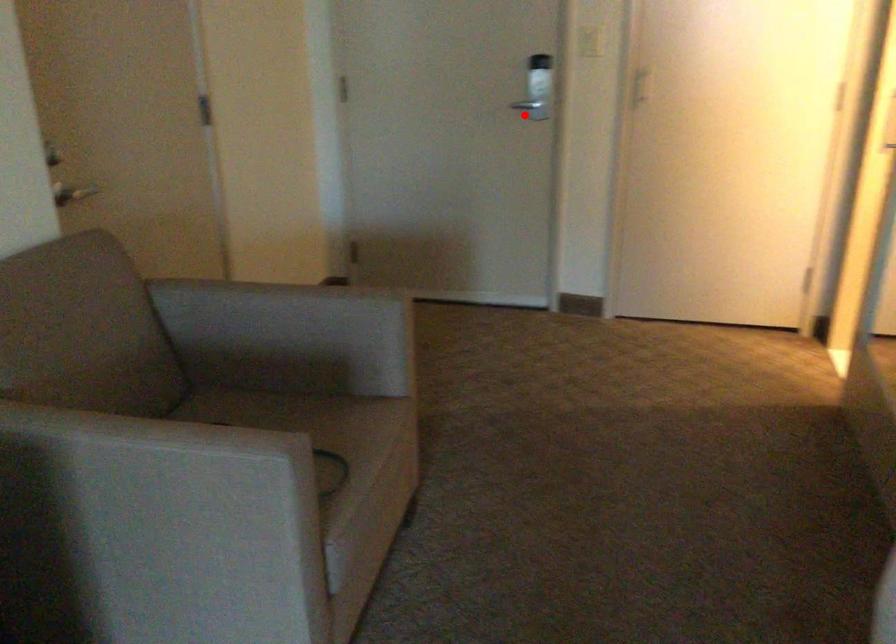
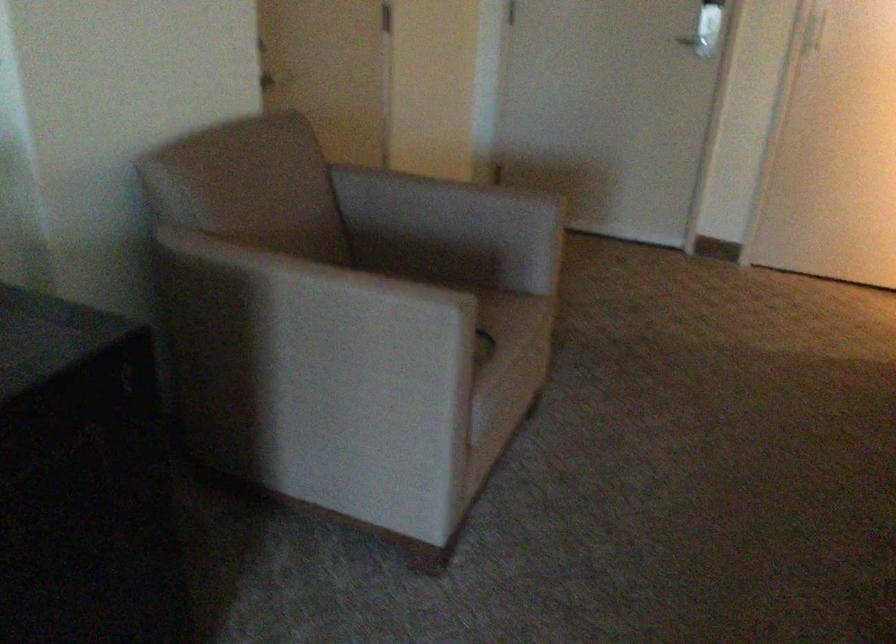
Where in the second image is the point corresponding to the highlighted location from the first image?

(694, 41)